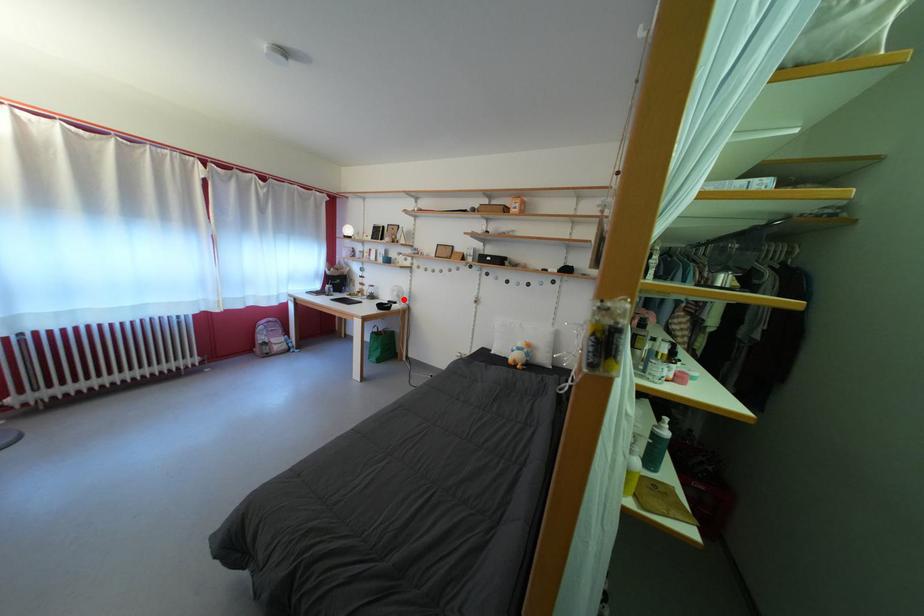
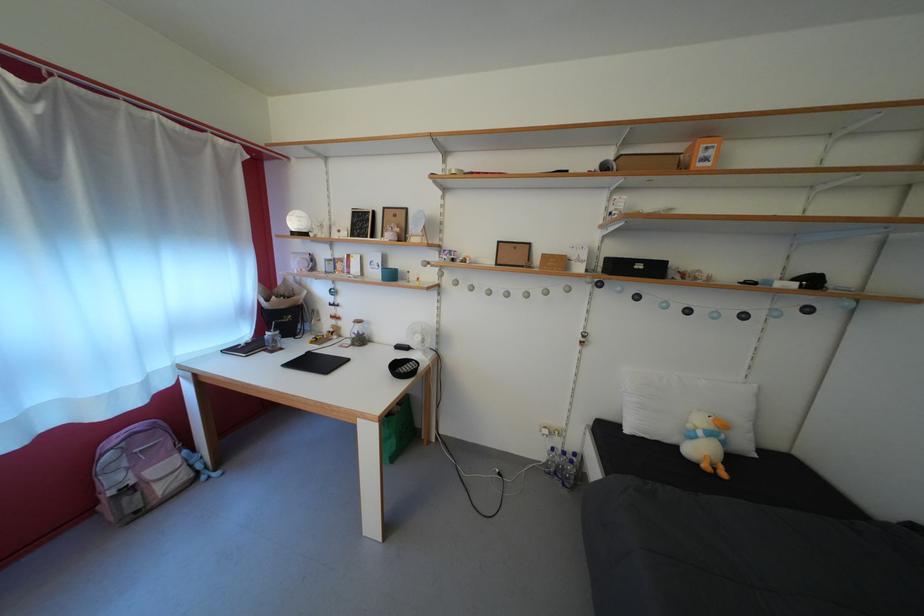
Question: I am providing you with two images of the same scene from different viewpoints. Image1 has a red point marked. In image2, the corresponding 3D location appears at what relative position? Reply with the corresponding letter.

Choices:
 (A) Closer
 (B) Farther

Answer: (B)